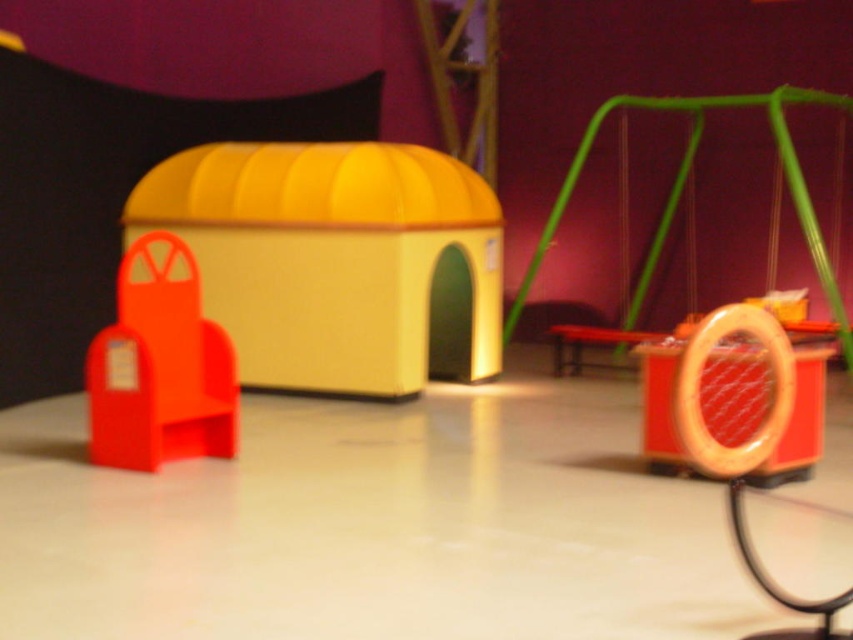
Is point (320, 340) more distant than point (614, 346)?

No.

Between yellow matte plastic house at center and matte orange stool at center, which one appears on the right side from the viewer's perspective?

From the viewer's perspective, matte orange stool at center appears more on the right side.

Looking at this image, measure the distance between point [410,156] and camera.

Point [410,156] is 32.34 feet from camera.

The width and height of the screenshot is (853, 640). In order to click on yellow matte plastic house at center in this screenshot , I will do `click(335, 260)`.

Which is more to the left, orange matte bookend at left or matte orange stool at center?

orange matte bookend at left is more to the left.

Is point (125, 316) farther from camera compared to point (613, 344)?

No, (125, 316) is in front of (613, 344).

You are a GUI agent. You are given a task and a screenshot of the screen. Output one action in this format:
    pyautogui.click(x=<x>, y=<y>)
    Task: Click on the orange matte bookend at left
    The height and width of the screenshot is (640, 853).
    Given the screenshot: What is the action you would take?
    pyautogui.click(x=160, y=365)

Can you confirm if yellow matte plastic house at center is wider than orange matte bookend at left?

Yes.

Measure the distance between point (x=396, y=276) and camera.

9.28 meters

Where is `yellow matte plastic house at center`? Image resolution: width=853 pixels, height=640 pixels. yellow matte plastic house at center is located at coordinates (335, 260).